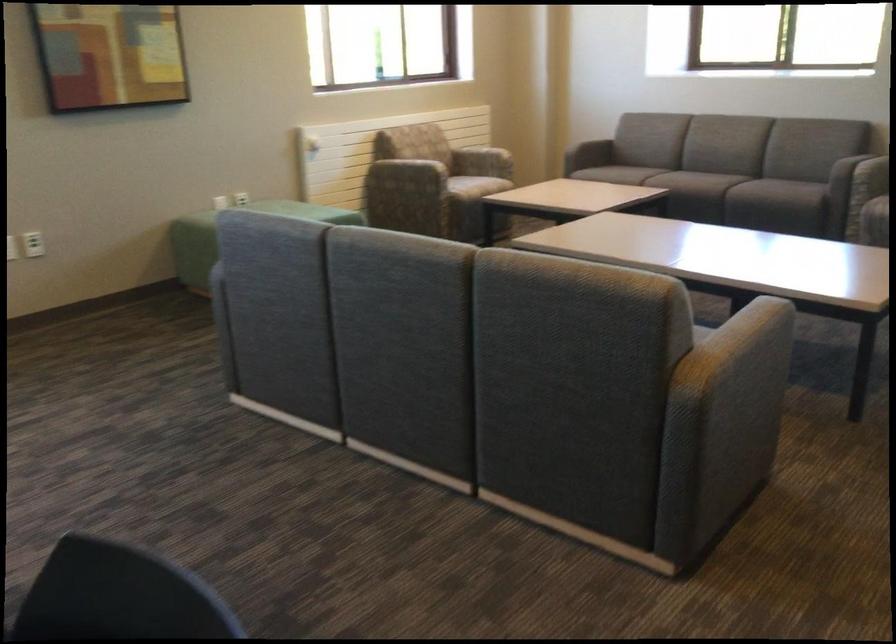
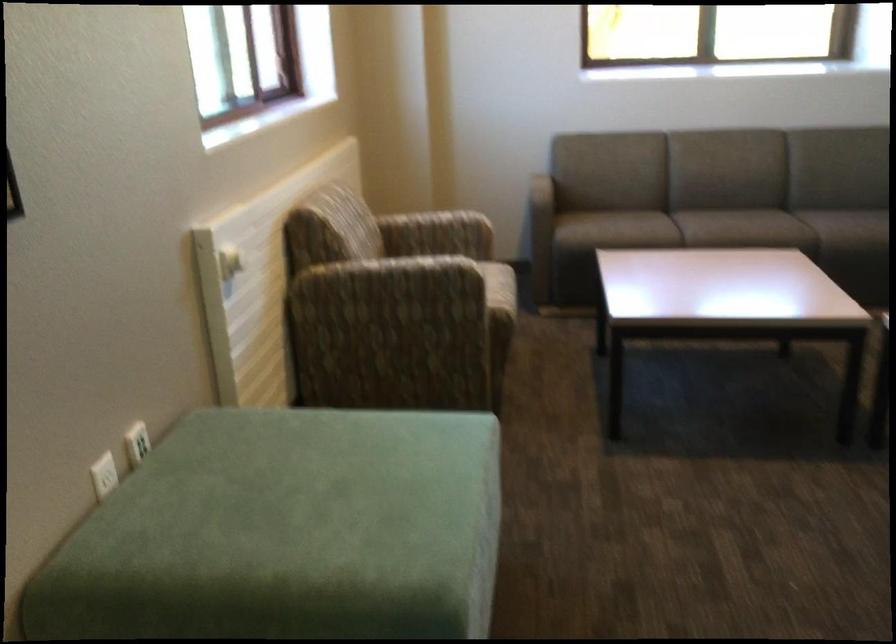
Locate, in the second image, the point that corresponds to (392,182) in the first image.

(386, 312)